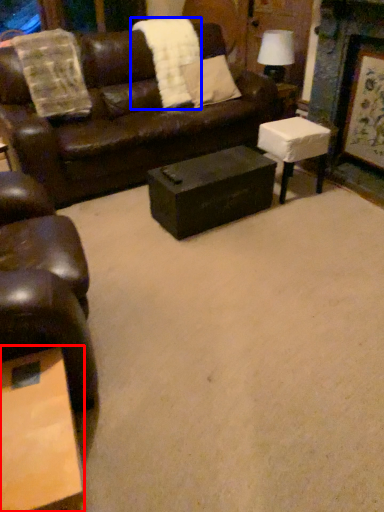
Question: Which object is closer to the camera taking this photo, coffee table (highlighted by a red box) or blanket (highlighted by a blue box)?

Choices:
 (A) coffee table
 (B) blanket

Answer: (A)